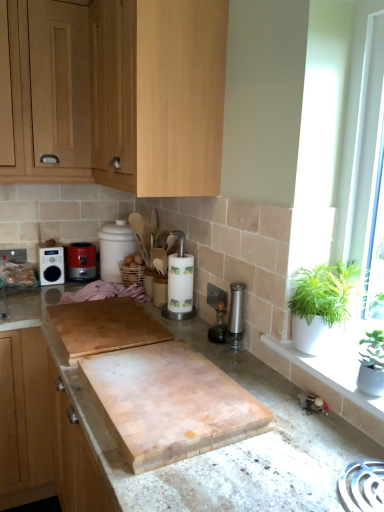
Find the location of a particular element. This screenshot has height=512, width=384. green leafy plant at right, the second houseplant when ordered from front to back is located at coordinates (320, 305).

What do you see at coordinates (320, 305) in the screenshot?
I see `green leafy plant at right, the first houseplant positioned from the back` at bounding box center [320, 305].

Find the location of `light wood cabinet at upper left, the 2th cabinetry positioned from the bottom`. light wood cabinet at upper left, the 2th cabinetry positioned from the bottom is located at coordinates (114, 93).

Measure the distance between light wood cabinet at left, the third cabinetry when ordered from top to bottom, and camera.

The distance of light wood cabinet at left, the third cabinetry when ordered from top to bottom, from camera is 1.69 meters.

What do you see at coordinates (45, 92) in the screenshot? The width and height of the screenshot is (384, 512). I see `light wood cabinet at upper left, which is counted as the 1th cabinetry, starting from the top` at bounding box center [45, 92].

Locate an element on the screen. The width and height of the screenshot is (384, 512). white wooden frame at right is located at coordinates (339, 140).

Find the location of a particular element. The height and width of the screenshot is (512, 384). kitchen appliance below the light wood cabinet at upper left, arranged as the 3th cabinetry when ordered from the bottom (from a real-world perspective) is located at coordinates (81, 261).

Does metallic red toaster at left have a greater height compared to light wood cabinet at upper left, which is counted as the 1th cabinetry, starting from the top?

No, metallic red toaster at left is not taller than light wood cabinet at upper left, which is counted as the 1th cabinetry, starting from the top.

From the image's perspective, is white wooden frame at right above or below matte black radio at left?

white wooden frame at right is above matte black radio at left.

Measure the distance from white wooden frame at right to matte black radio at left.

white wooden frame at right and matte black radio at left are 1.41 meters apart from each other.

What's the angular difference between white wooden frame at right and matte black radio at left's facing directions?

white wooden frame at right and matte black radio at left are facing 88.9 degrees away from each other.

Is white wooden frame at right oriented towards matte black radio at left?

No, white wooden frame at right does not turn towards matte black radio at left.

Is green leafy plant in white pot at right, marked as the 1th houseplant in a front-to-back arrangement, outside of light wood cabinet at upper left, arranged as the 3th cabinetry when ordered from the bottom?

Absolutely, green leafy plant in white pot at right, marked as the 1th houseplant in a front-to-back arrangement, is external to light wood cabinet at upper left, arranged as the 3th cabinetry when ordered from the bottom.

Who is more distant, green leafy plant in white pot at right, positioned as the second houseplant in back-to-front order, or light wood cabinet at upper left, which is counted as the 1th cabinetry, starting from the top?

light wood cabinet at upper left, which is counted as the 1th cabinetry, starting from the top, is further from the camera.

Measure the distance between green leafy plant in white pot at right, positioned as the second houseplant in back-to-front order, and light wood cabinet at upper left, which is counted as the 1th cabinetry, starting from the top.

green leafy plant in white pot at right, positioned as the second houseplant in back-to-front order, is 4.99 feet away from light wood cabinet at upper left, which is counted as the 1th cabinetry, starting from the top.

Are green leafy plant in white pot at right, marked as the 1th houseplant in a front-to-back arrangement, and light wood cabinet at upper left, which is counted as the 1th cabinetry, starting from the top, located far from each other?

green leafy plant in white pot at right, marked as the 1th houseplant in a front-to-back arrangement, is far away from light wood cabinet at upper left, which is counted as the 1th cabinetry, starting from the top.

In terms of size, does light wood cabinet at left, the third cabinetry when ordered from top to bottom, appear bigger or smaller than matte black radio at left?

Clearly, light wood cabinet at left, the third cabinetry when ordered from top to bottom, is larger in size than matte black radio at left.

Does light wood cabinet at left, the third cabinetry when ordered from top to bottom, lie behind matte black radio at left?

No, light wood cabinet at left, the third cabinetry when ordered from top to bottom, is in front of matte black radio at left.

Who is taller, light wood cabinet at left, the third cabinetry when ordered from top to bottom, or matte black radio at left?

Standing taller between the two is light wood cabinet at left, the third cabinetry when ordered from top to bottom.

Is light wood cabinet at left, the third cabinetry when ordered from top to bottom, to the left or to the right of matte black radio at left in the image?

In the image, light wood cabinet at left, the third cabinetry when ordered from top to bottom, appears on the left side of matte black radio at left.

Can you confirm if metallic red toaster at left is thinner than green leafy plant in white pot at right, positioned as the second houseplant in back-to-front order?

No, metallic red toaster at left is not thinner than green leafy plant in white pot at right, positioned as the second houseplant in back-to-front order.

Between metallic red toaster at left and green leafy plant in white pot at right, marked as the 1th houseplant in a front-to-back arrangement, which one is positioned in front?

green leafy plant in white pot at right, marked as the 1th houseplant in a front-to-back arrangement, is more forward.

Is point (76, 259) farther from camera compared to point (361, 361)?

That is True.

Consider the image. Considering the sizes of objects metallic red toaster at left and green leafy plant in white pot at right, positioned as the second houseplant in back-to-front order, in the image provided, who is smaller, metallic red toaster at left or green leafy plant in white pot at right, positioned as the second houseplant in back-to-front order,?

Smaller between the two is green leafy plant in white pot at right, positioned as the second houseplant in back-to-front order.

Considering the sizes of white wooden frame at right and metallic red toaster at left in the image, is white wooden frame at right wider or thinner than metallic red toaster at left?

Considering their sizes, white wooden frame at right looks slimmer than metallic red toaster at left.

Would you say white wooden frame at right is outside metallic red toaster at left?

Absolutely, white wooden frame at right is external to metallic red toaster at left.

Could you tell me if white wooden frame at right is facing metallic red toaster at left?

No, white wooden frame at right is not facing towards metallic red toaster at left.

The width and height of the screenshot is (384, 512). In order to click on window frame lying on the right of metallic red toaster at left in this screenshot , I will do `click(339, 140)`.

Is light wood cabinet at left, the third cabinetry when ordered from top to bottom, wider than light wood cabinet at upper left, the 2th cabinetry positioned from the bottom?

In fact, light wood cabinet at left, the third cabinetry when ordered from top to bottom, might be narrower than light wood cabinet at upper left, the 2th cabinetry positioned from the bottom.

Can we say light wood cabinet at left, the third cabinetry when ordered from top to bottom, lies outside light wood cabinet at upper left, which appears as the second cabinetry when viewed from the top?

Absolutely, light wood cabinet at left, the third cabinetry when ordered from top to bottom, is external to light wood cabinet at upper left, which appears as the second cabinetry when viewed from the top.

Does point (41, 413) appear closer or farther from the camera than point (43, 180)?

Point (41, 413).

From the image's perspective, which one is positioned higher, light wood cabinet at left, the third cabinetry when ordered from top to bottom, or light wood cabinet at upper left, which appears as the second cabinetry when viewed from the top?

light wood cabinet at upper left, which appears as the second cabinetry when viewed from the top.

You are a GUI agent. You are given a task and a screenshot of the screen. Output one action in this format:
    pyautogui.click(x=<x>, y=<y>)
    Task: Click on the kitchen appliance below the light wood cabinet at upper left, arranged as the 3th cabinetry when ordered from the bottom (from a real-world perspective)
    
    Given the screenshot: What is the action you would take?
    pyautogui.click(x=81, y=261)

Locate an element on the screen. Image resolution: width=384 pixels, height=512 pixels. window frame above the matte black radio at left (from the image's perspective) is located at coordinates (x=339, y=140).

Considering their positions, is light wood cabinet at upper left, which appears as the second cabinetry when viewed from the top, positioned further to green leafy plant at right, the first houseplant positioned from the back, than white wooden frame at right?

The object further to green leafy plant at right, the first houseplant positioned from the back, is light wood cabinet at upper left, which appears as the second cabinetry when viewed from the top.

Considering their positions, is light wood cabinet at upper left, which is counted as the 1th cabinetry, starting from the top, positioned further to white wooden frame at right than light wood cabinet at left, the first cabinetry from the bottom?

light wood cabinet at left, the first cabinetry from the bottom.

Which object lies nearer to the anchor point green leafy plant at right, the second houseplant when ordered from front to back, metallic red toaster at left or white wooden frame at right?

white wooden frame at right.

Estimate the real-world distances between objects in this image. Which object is further from light wood cabinet at upper left, arranged as the 3th cabinetry when ordered from the bottom, green leafy plant in white pot at right, marked as the 1th houseplant in a front-to-back arrangement, or light wood cabinet at upper left, the 2th cabinetry positioned from the bottom?

green leafy plant in white pot at right, marked as the 1th houseplant in a front-to-back arrangement, is positioned further to the anchor light wood cabinet at upper left, arranged as the 3th cabinetry when ordered from the bottom.

Considering their positions, is metallic red toaster at left positioned closer to light wood cabinet at left, the first cabinetry from the bottom, than green leafy plant at right, the second houseplant when ordered from front to back?

metallic red toaster at left is positioned closer to the anchor light wood cabinet at left, the first cabinetry from the bottom.

Which object lies nearer to the anchor point green leafy plant in white pot at right, positioned as the second houseplant in back-to-front order, light wood cabinet at upper left, arranged as the 3th cabinetry when ordered from the bottom, or metallic red toaster at left?

Among the two, metallic red toaster at left is located nearer to green leafy plant in white pot at right, positioned as the second houseplant in back-to-front order.

From the picture: Which object lies nearer to the anchor point matte black radio at left, light wood cabinet at left, the first cabinetry from the bottom, or green leafy plant in white pot at right, marked as the 1th houseplant in a front-to-back arrangement?

Based on the image, light wood cabinet at left, the first cabinetry from the bottom, appears to be nearer to matte black radio at left.

Which object lies further to the anchor point green leafy plant in white pot at right, marked as the 1th houseplant in a front-to-back arrangement, metallic red toaster at left or white wooden frame at right?

The object further to green leafy plant in white pot at right, marked as the 1th houseplant in a front-to-back arrangement, is metallic red toaster at left.

This screenshot has width=384, height=512. I want to click on kitchen appliance situated between light wood cabinet at left, the first cabinetry from the bottom, and white wooden frame at right from left to right, so click(81, 261).

This screenshot has width=384, height=512. In order to click on kitchen appliance between light wood cabinet at upper left, arranged as the 3th cabinetry when ordered from the bottom, and green leafy plant in white pot at right, marked as the 1th houseplant in a front-to-back arrangement in this screenshot , I will do `click(81, 261)`.

This screenshot has width=384, height=512. What are the coordinates of `appliance between light wood cabinet at left, the third cabinetry when ordered from top to bottom, and white wooden frame at right from left to right` in the screenshot? It's located at (51, 265).

Locate an element on the screen. The height and width of the screenshot is (512, 384). houseplant between light wood cabinet at upper left, the 2th cabinetry positioned from the bottom, and green leafy plant in white pot at right, positioned as the second houseplant in back-to-front order, in the up-down direction is located at coordinates 320,305.